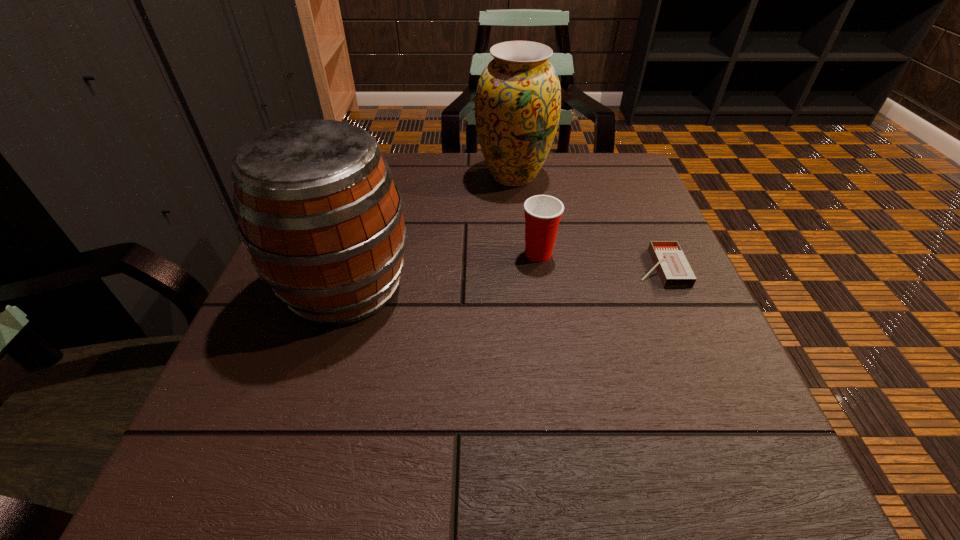
The image size is (960, 540). Find the location of `free space that satisfies the following two spatial constraints: 1. on the front side of the farthest object; 2. on the left side of the Dixie cup`. free space that satisfies the following two spatial constraints: 1. on the front side of the farthest object; 2. on the left side of the Dixie cup is located at coordinates (521, 254).